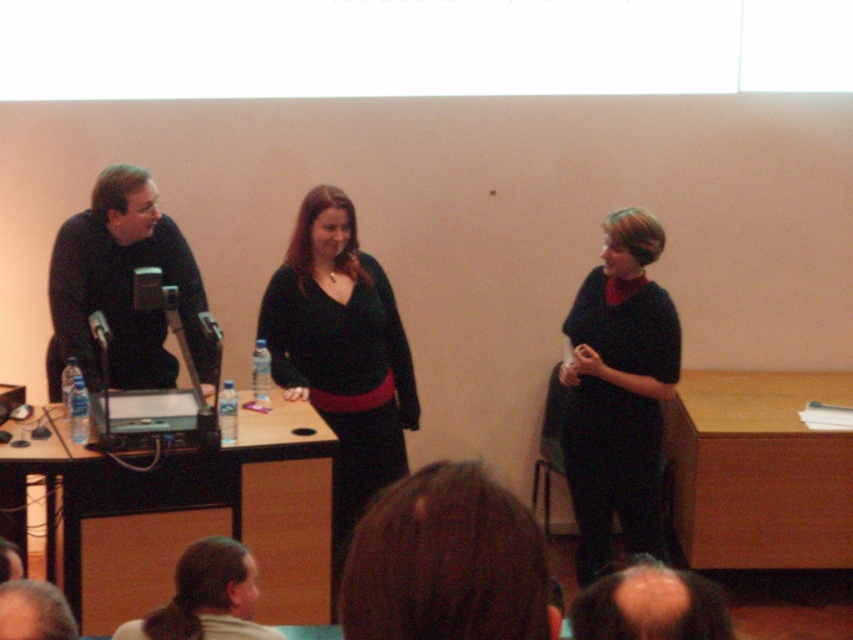
Question: Among these points, which one is nearest to the camera?

Choices:
 (A) (103, 170)
 (B) (283, 289)

Answer: (B)

Question: Is matte black microphone at left positioned in front of light brown hair at lower center?

Choices:
 (A) no
 (B) yes

Answer: (A)

Question: Can you confirm if matte black sweater at center is positioned to the right of matte black sweater at right?

Choices:
 (A) no
 (B) yes

Answer: (A)

Question: Which object is closer to the camera taking this photo?

Choices:
 (A) light brown hair at lower center
 (B) matte black sweater at center
 (C) matte black microphone at left
 (D) matte black sweater at right

Answer: (A)

Question: Which of the following is the farthest from the observer?

Choices:
 (A) (630, 292)
 (B) (276, 339)
 (C) (202, 545)

Answer: (B)

Question: Is matte black sweater at center above matte black sweater at right?

Choices:
 (A) no
 (B) yes

Answer: (B)